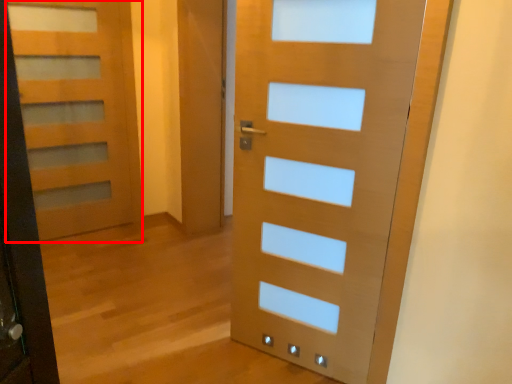
Question: Considering the relative positions of door (annotated by the red box) and door in the image provided, where is door (annotated by the red box) located with respect to the staircase?

Choices:
 (A) left
 (B) right

Answer: (A)